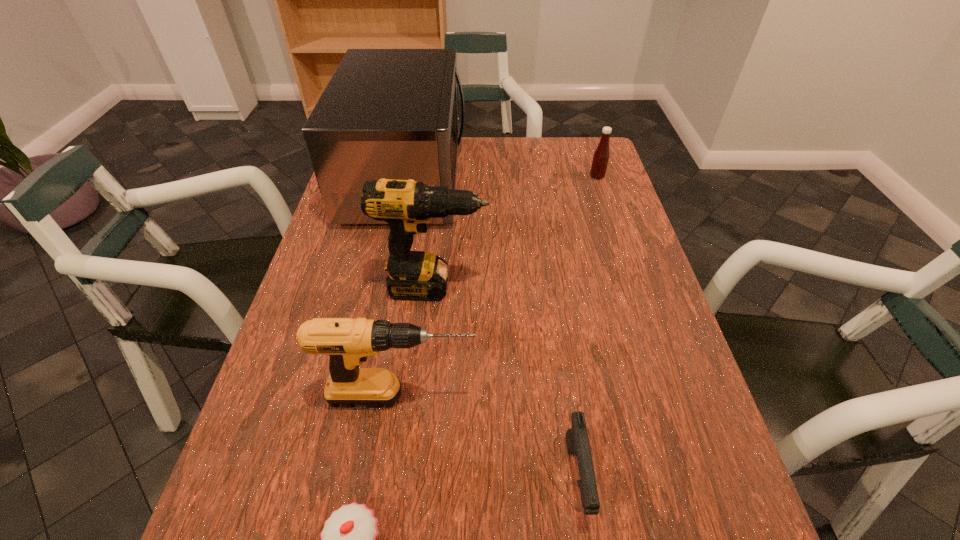
Where is `microwave oven`? This screenshot has height=540, width=960. microwave oven is located at coordinates (386, 113).

At what (x,y) coordinates should I click in order to perform the action: click on the third farthest object. Please return your answer as a coordinate pair (x, y). The width and height of the screenshot is (960, 540). Looking at the image, I should click on (406, 205).

Find the location of a particular element. The width and height of the screenshot is (960, 540). the farther drill is located at coordinates (406, 205).

Where is `the nearer drill`? The width and height of the screenshot is (960, 540). the nearer drill is located at coordinates (348, 342).

Identify the location of the shorter drill. (348, 342).

Locate an element on the screen. The image size is (960, 540). Tabasco sauce is located at coordinates click(601, 155).

In order to click on the third shortest object in this screenshot , I will do `click(601, 155)`.

The height and width of the screenshot is (540, 960). Find the location of `the second object from right to left`. the second object from right to left is located at coordinates (577, 440).

Find the location of a particular element. The image size is (960, 540). pistol is located at coordinates (577, 440).

Identify the location of blank area located 0.110m on the front-facing side of the microwave oven. The image size is (960, 540). (500, 178).